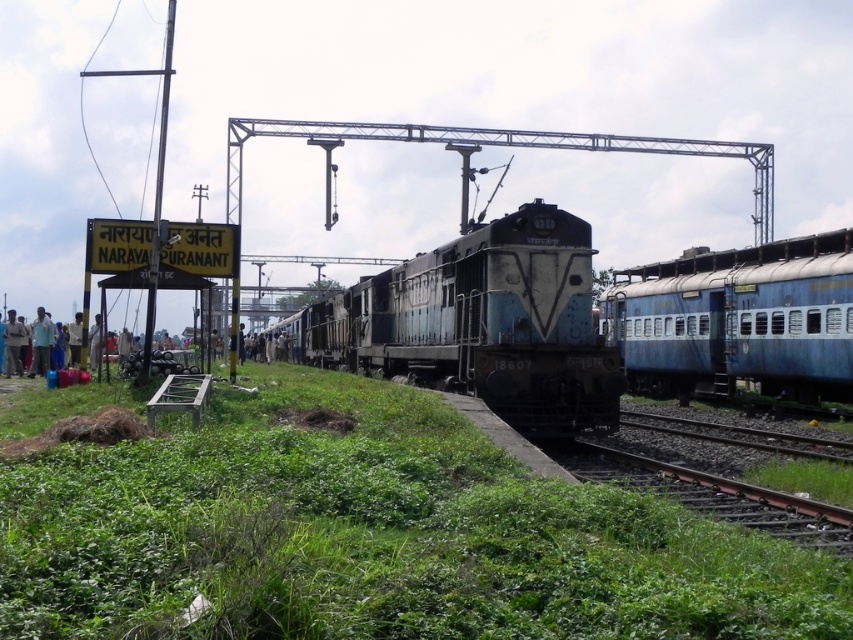
Between blue painted metal passenger train at right and light blue shirt at left, which one has more height?

With more height is blue painted metal passenger train at right.

Can you confirm if blue painted metal passenger train at right is positioned below light blue shirt at left?

Actually, blue painted metal passenger train at right is above light blue shirt at left.

Is point (650, 346) in front of point (45, 342)?

No.

At what (x,y) coordinates should I click in order to perform the action: click on blue painted metal passenger train at right. Please return your answer as a coordinate pair (x, y). This screenshot has width=853, height=640. Looking at the image, I should click on point(738,320).

Who is shorter, dirty metallic train at center or light brown fabric shirt at lower left?

light brown fabric shirt at lower left

From the picture: Can you confirm if dirty metallic train at center is smaller than light brown fabric shirt at lower left?

No.

Does point (366, 358) lie in front of point (9, 339)?

No, (366, 358) is behind (9, 339).

In order to click on dirty metallic train at center in this screenshot , I will do `click(482, 323)`.

Who is taller, rusty metal train track at lower right or light brown fabric shirt at lower left?

light brown fabric shirt at lower left is taller.

Is rusty metal train track at lower right taller than light brown fabric shirt at lower left?

In fact, rusty metal train track at lower right may be shorter than light brown fabric shirt at lower left.

Does point (573, 454) lie in front of point (15, 310)?

Yes, it is.

The height and width of the screenshot is (640, 853). What are the coordinates of `rusty metal train track at lower right` in the screenshot? It's located at (712, 493).